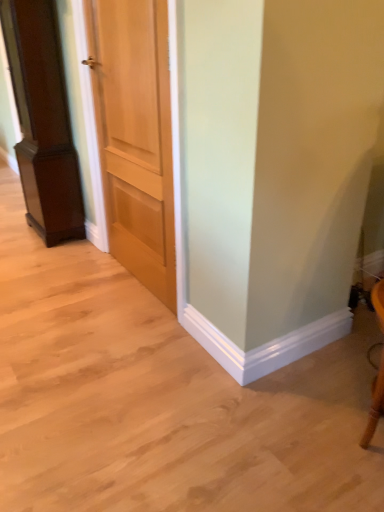
Where is `vacant space situated on the left part of light brown wood door at center`? The width and height of the screenshot is (384, 512). vacant space situated on the left part of light brown wood door at center is located at coordinates (64, 282).